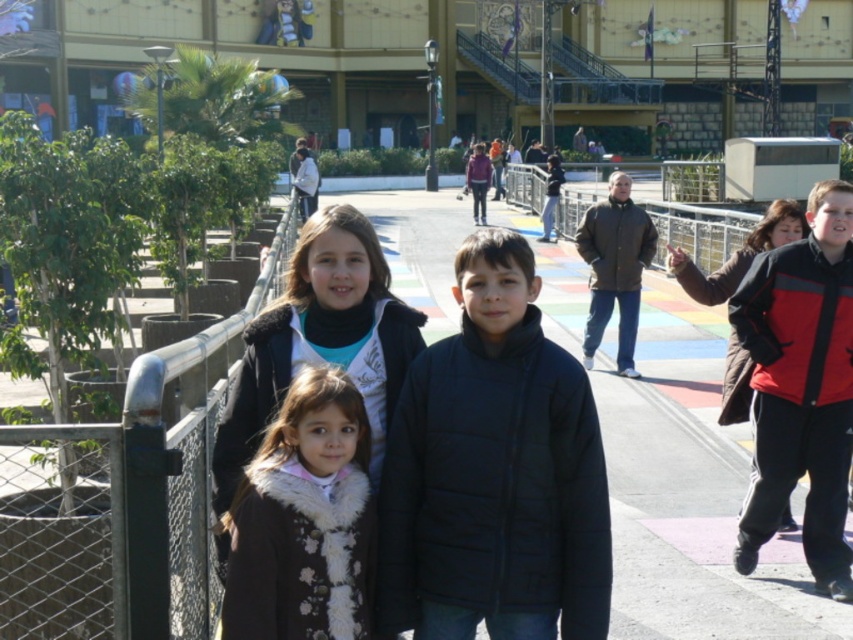
Question: Which point is closer to the camera taking this photo?

Choices:
 (A) (206, 464)
 (B) (241, 502)
 (C) (741, 541)

Answer: (B)

Question: Which object is farther from the camera taking this photo?

Choices:
 (A) black quilted jacket at center
 (B) metallic silver fence at upper center
 (C) multicolored painted pavement at center
 (D) white fur coat at center

Answer: (B)

Question: Is red and black jacket at right wider than white fur coat at center?

Choices:
 (A) yes
 (B) no

Answer: (A)

Question: Can you confirm if black quilted jacket at center is wider than white fur coat at center?

Choices:
 (A) yes
 (B) no

Answer: (A)

Question: Is multicolored painted pavement at center bigger than black quilted jacket at center?

Choices:
 (A) yes
 (B) no

Answer: (A)

Question: Considering the real-world distances, which object is farthest from the white fur coat at center?

Choices:
 (A) metallic silver fence at upper center
 (B) dark brown fur coat at center
 (C) black quilted jacket at center
 (D) multicolored painted pavement at center

Answer: (A)